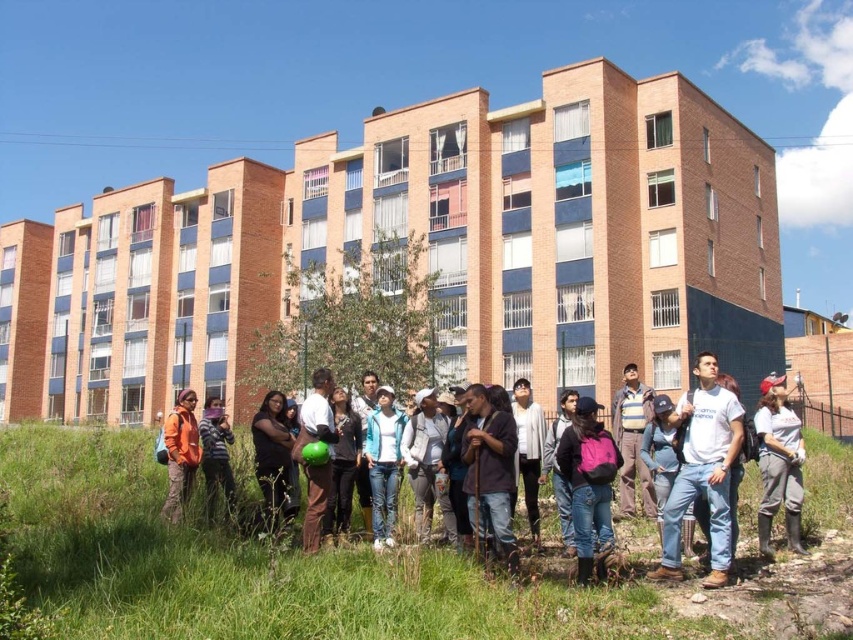
Question: Does pink fabric backpack at center have a lesser width compared to striped sweater at lower left?

Choices:
 (A) no
 (B) yes

Answer: (B)

Question: Which of the following is the farthest from the observer?

Choices:
 (A) (770, 440)
 (B) (589, 456)
 (C) (223, 452)

Answer: (C)

Question: Considering the relative positions of white cotton t-shirt at center and gray rubber boots at lower right in the image provided, where is white cotton t-shirt at center located with respect to gray rubber boots at lower right?

Choices:
 (A) below
 (B) above

Answer: (A)

Question: Which point appears closest to the camera in this image?

Choices:
 (A) (596, 550)
 (B) (779, 460)
 (C) (656, 396)
 (D) (677, 502)

Answer: (D)

Question: Which object is positioned farthest from the denim jacket at center?

Choices:
 (A) orange fabric jacket at lower left
 (B) gray rubber boots at lower right
 (C) striped sweater at lower left

Answer: (A)

Question: Is white cotton t-shirt at center positioned at the back of gray rubber boots at lower right?

Choices:
 (A) yes
 (B) no

Answer: (B)